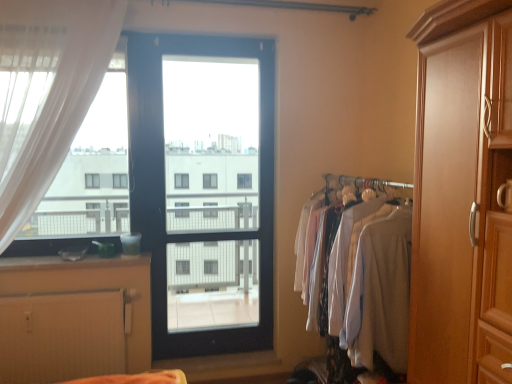
Where is `free space above white textured radiator at lower left (from a real-world perspective)`? The height and width of the screenshot is (384, 512). free space above white textured radiator at lower left (from a real-world perspective) is located at coordinates (72, 291).